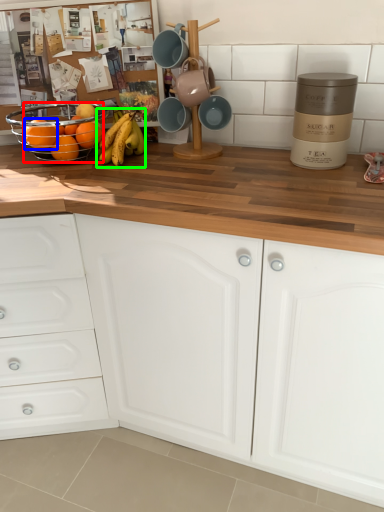
Question: Estimate the real-world distances between objects in this image. Which object is closer to orange (highlighted by a red box), orange (highlighted by a blue box) or banana (highlighted by a green box)?

Choices:
 (A) orange
 (B) banana

Answer: (A)